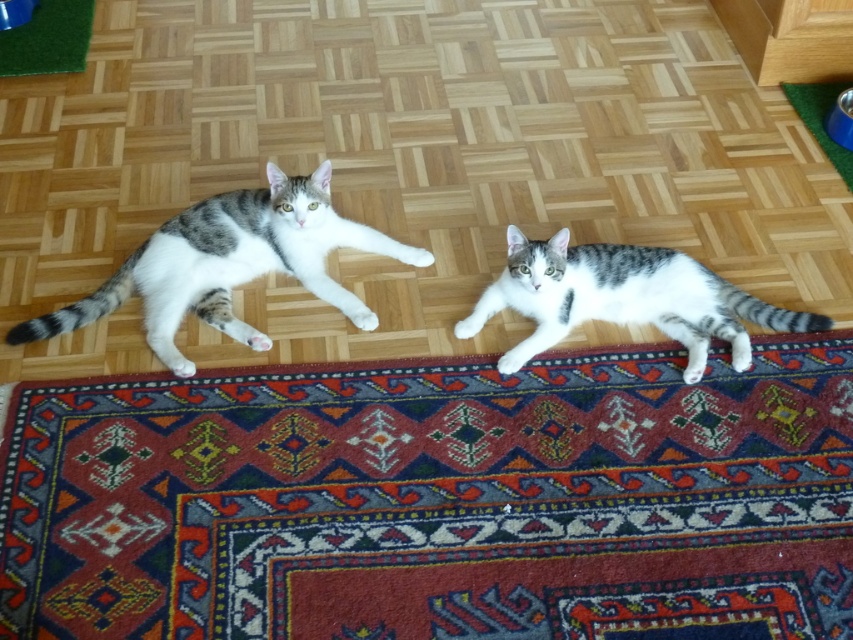
You are a small toy that is 2 feet wide. You want to move from the carpet with intricate patterns at center to the green artificial turf at upper left. Can you fit through the space between them?

The distance between the carpet with intricate patterns at center and the green artificial turf at upper left is 5.60 feet. Since the toy is only 2 feet wide, it can easily fit through the space between them.